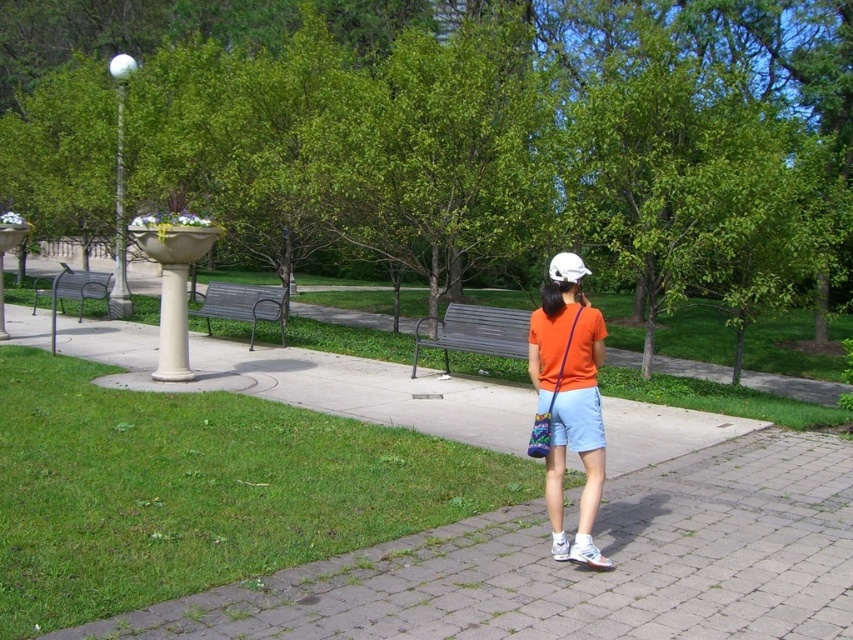
Is gray brick pavement at lower center smaller than white marble pillar at left?

Actually, gray brick pavement at lower center might be larger than white marble pillar at left.

Does gray brick pavement at lower center have a lesser width compared to white marble pillar at left?

No, gray brick pavement at lower center is not thinner than white marble pillar at left.

Where is `gray brick pavement at lower center`? This screenshot has height=640, width=853. gray brick pavement at lower center is located at coordinates (577, 564).

The height and width of the screenshot is (640, 853). Describe the element at coordinates (476, 332) in the screenshot. I see `wooden bench at center` at that location.

Is wooden bench at center to the right of white marble pillar at left from the viewer's perspective?

Indeed, wooden bench at center is positioned on the right side of white marble pillar at left.

Where is `wooden bench at center`? The width and height of the screenshot is (853, 640). wooden bench at center is located at coordinates (476, 332).

Which is more to the right, wooden bench at center or metallic gray bench at center?

wooden bench at center

Is point (502, 326) more distant than point (219, 317)?

That is False.

The image size is (853, 640). What do you see at coordinates (476, 332) in the screenshot?
I see `wooden bench at center` at bounding box center [476, 332].

You are a GUI agent. You are given a task and a screenshot of the screen. Output one action in this format:
    pyautogui.click(x=<x>, y=<y>)
    Task: Click on the wooden bench at center
    The height and width of the screenshot is (640, 853).
    Given the screenshot: What is the action you would take?
    pyautogui.click(x=476, y=332)